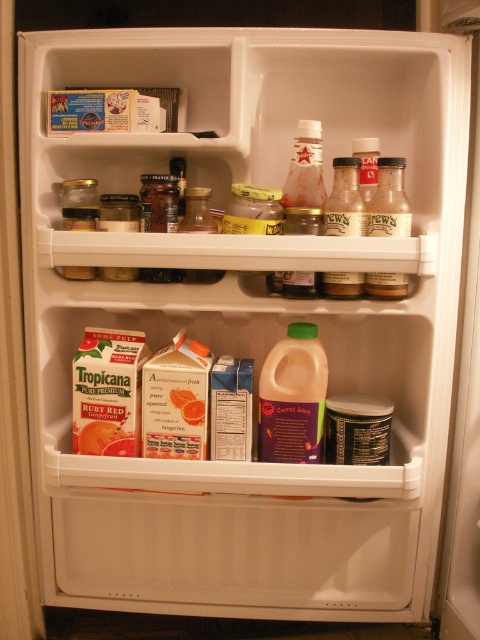
Question: Is translucent glass bottle at upper right to the right of translucent glass bottle at center from the viewer's perspective?

Choices:
 (A) yes
 (B) no

Answer: (A)

Question: Is translucent plastic jar of carrot juice at lower center positioned before translucent glass bottle at center?

Choices:
 (A) no
 (B) yes

Answer: (A)

Question: Can you confirm if translucent plastic jar of carrot juice at lower center is positioned to the right of translucent glass bottle at center?

Choices:
 (A) yes
 (B) no

Answer: (B)

Question: Which point is closer to the camera taking this photo?

Choices:
 (A) (352, 227)
 (B) (276, 406)

Answer: (A)

Question: Which point is farther to the camera?

Choices:
 (A) (266, 444)
 (B) (371, 225)

Answer: (A)

Question: Which point is farther to the camera?

Choices:
 (A) translucent plastic jar of carrot juice at lower center
 (B) translucent glass bottle at upper right

Answer: (A)